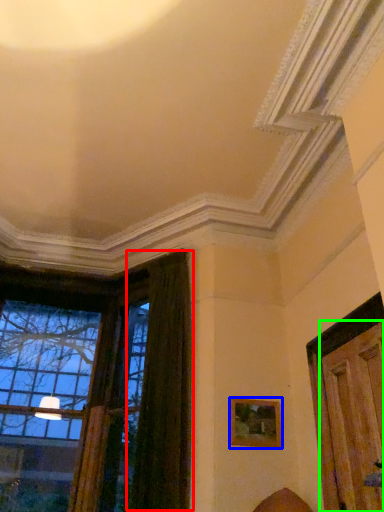
Question: Estimate the real-world distances between objects in this image. Which object is closer to curtain (highlighted by a red box), picture frame (highlighted by a blue box) or door (highlighted by a green box)?

Choices:
 (A) picture frame
 (B) door

Answer: (A)